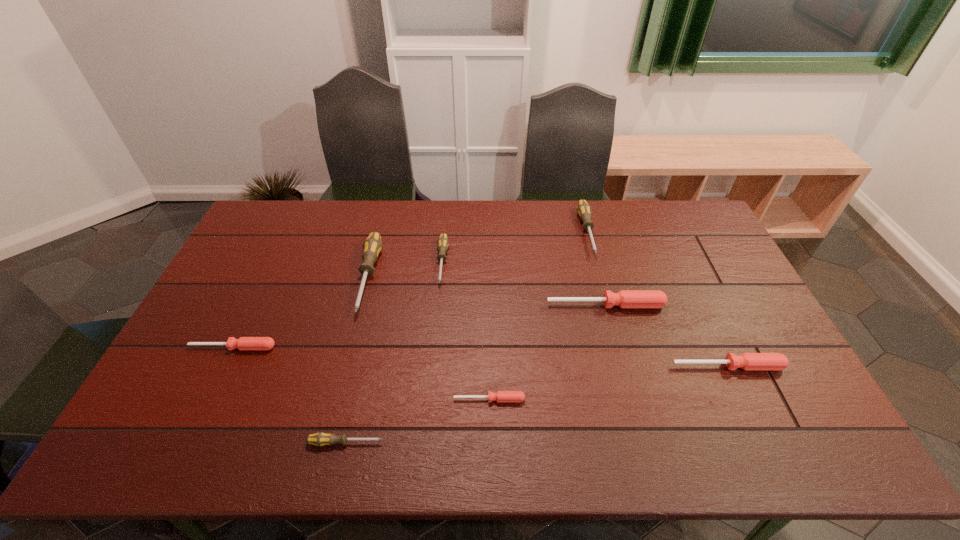
Where is `blank space that satisfies the following two spatial constraints: 1. at the tip of the tallest screwdriver; 2. on the left side of the fourth object from right to left`? Image resolution: width=960 pixels, height=540 pixels. blank space that satisfies the following two spatial constraints: 1. at the tip of the tallest screwdriver; 2. on the left side of the fourth object from right to left is located at coordinates (337, 399).

Where is `blank area in the image that satisfies the following two spatial constraints: 1. at the tip of the biggest gray screwdriver; 2. on the right side of the sixth farthest object`? blank area in the image that satisfies the following two spatial constraints: 1. at the tip of the biggest gray screwdriver; 2. on the right side of the sixth farthest object is located at coordinates (346, 366).

Where is `vacant region that satisfies the following two spatial constraints: 1. at the tip of the tallest screwdriver; 2. on the left side of the third nearest screwdriver`? The width and height of the screenshot is (960, 540). vacant region that satisfies the following two spatial constraints: 1. at the tip of the tallest screwdriver; 2. on the left side of the third nearest screwdriver is located at coordinates (346, 366).